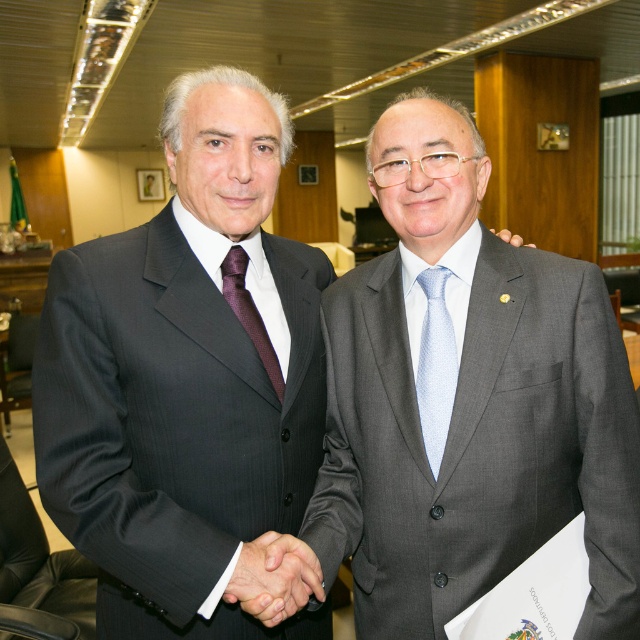
Question: Which point is farther to the camera?

Choices:
 (A) burgundy silk tie at center
 (B) matte black suit at center
 (C) dark gray pinstripe suit at left
 (D) matte black hand at upper center

Answer: (D)

Question: Can you confirm if burgundy silk tie at center is wider than matte black hand at upper center?

Choices:
 (A) no
 (B) yes

Answer: (A)

Question: Can you confirm if smooth leather hand at center is wider than light blue textured tie at center?

Choices:
 (A) yes
 (B) no

Answer: (A)

Question: Estimate the real-world distances between objects in this image. Which object is closer to the matte black hand at upper center?

Choices:
 (A) matte black suit at center
 (B) gray matte suit at center
 (C) burgundy silk tie at center
 (D) light blue textured tie at center

Answer: (D)

Question: Is smooth leather hand at center to the right of matte black hand at upper center from the viewer's perspective?

Choices:
 (A) yes
 (B) no

Answer: (B)

Question: Based on their relative distances, which object is farther from the matte black hand at upper center?

Choices:
 (A) matte black suit at center
 (B) gray matte suit at center
 (C) dark gray pinstripe suit at left

Answer: (C)